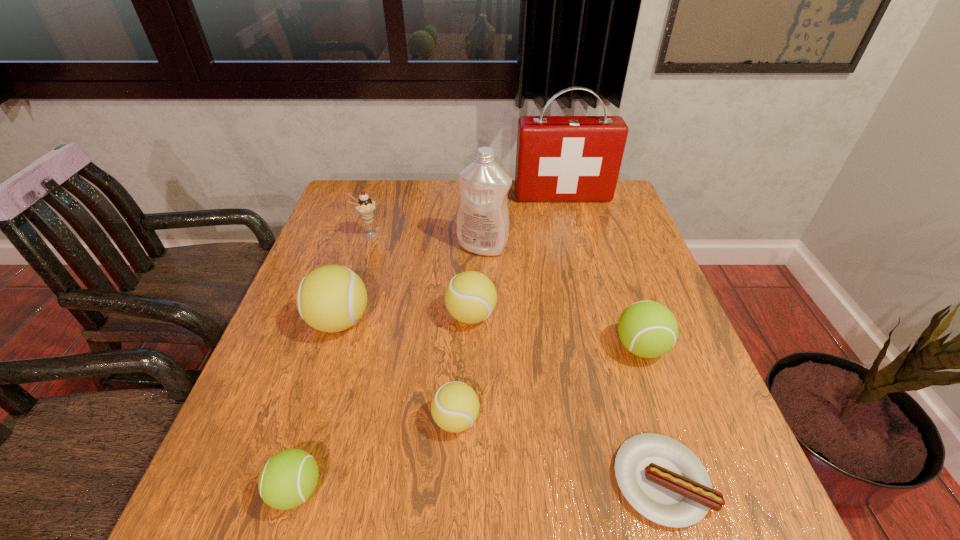
Where is `free space located on the back of the farther green tennis ball`? free space located on the back of the farther green tennis ball is located at coordinates (603, 236).

Where is `vacant space located 0.310m on the left of the smallest yellow tennis ball`? The image size is (960, 540). vacant space located 0.310m on the left of the smallest yellow tennis ball is located at coordinates (270, 420).

The image size is (960, 540). Identify the location of free region located on the back of the left green tennis ball. (336, 359).

Find the location of a particular element. Image resolution: width=960 pixels, height=540 pixels. free space located 0.150m on the left of the sausage is located at coordinates (526, 481).

You are a GUI agent. You are given a task and a screenshot of the screen. Output one action in this format:
    pyautogui.click(x=<x>, y=<y>)
    Task: Click on the object that is positioned at the far edge
    The width and height of the screenshot is (960, 540).
    Given the screenshot: What is the action you would take?
    pyautogui.click(x=559, y=158)

The width and height of the screenshot is (960, 540). What are the coordinates of `tennis ball located at the near edge` in the screenshot? It's located at (288, 479).

You are a GUI agent. You are given a task and a screenshot of the screen. Output one action in this format:
    pyautogui.click(x=<x>, y=<y>)
    Task: Click on the sausage located at the near edge
    This screenshot has height=540, width=960.
    Given the screenshot: What is the action you would take?
    pyautogui.click(x=663, y=480)

Where is `icecream situated at the left edge`? icecream situated at the left edge is located at coordinates (364, 205).

This screenshot has width=960, height=540. Identify the location of the first-aid kit present at the right edge. (559, 158).

Identify the location of tennis ball that is at the right edge. (648, 329).